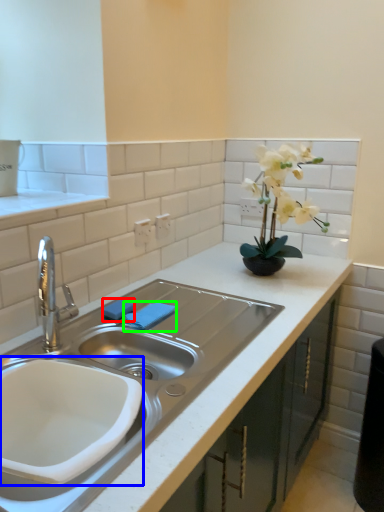
Question: Considering the real-world distances, which object is closest to soap (highlighted by a red box)? sink (highlighted by a blue box) or towel bar (highlighted by a green box).

Choices:
 (A) sink
 (B) towel bar

Answer: (B)